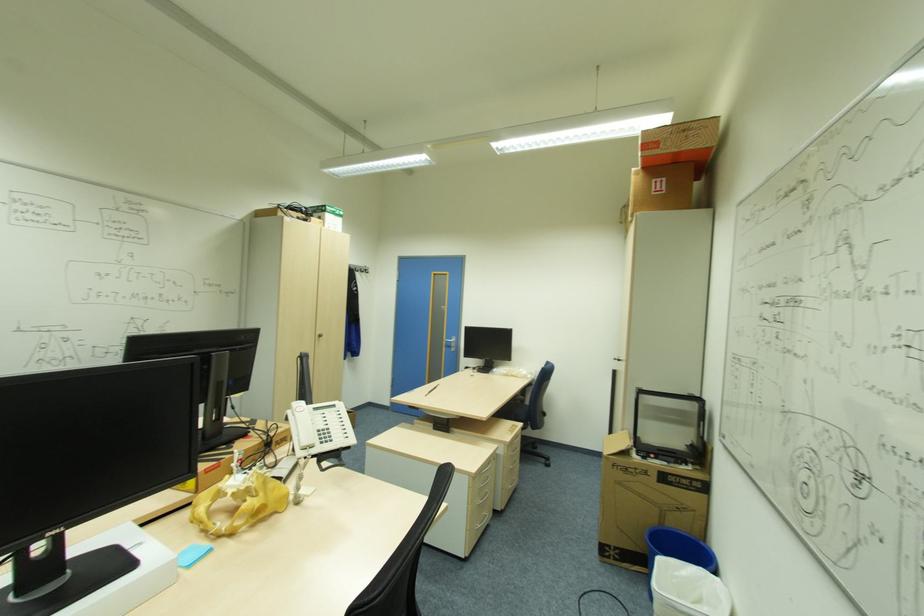
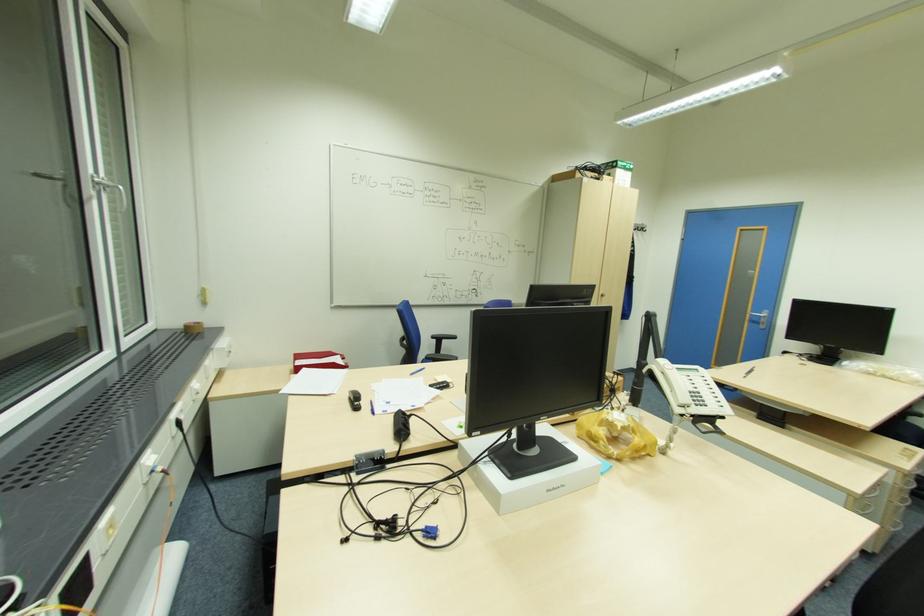
Locate, in the second image, the point that corresponds to pixel 143 543 in the first image.

(568, 442)